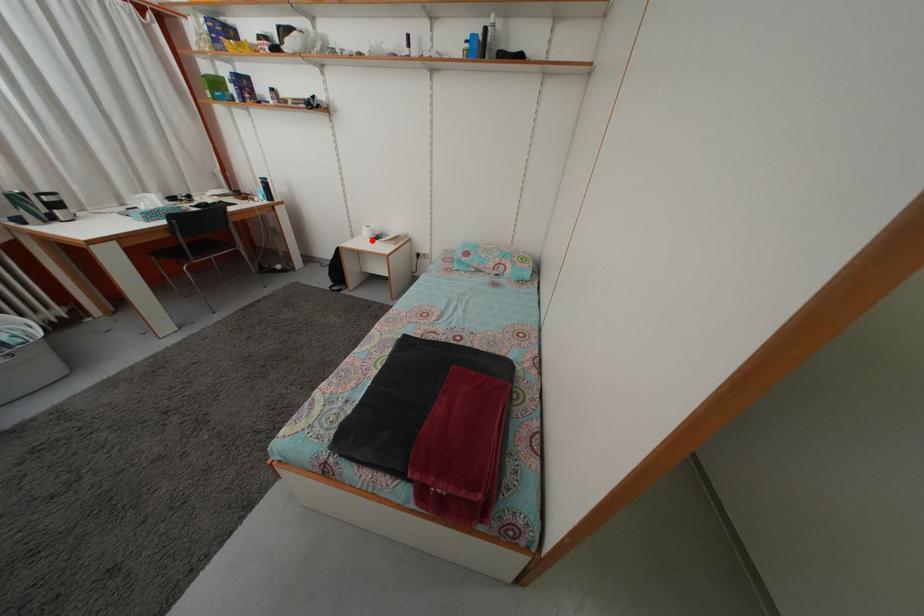
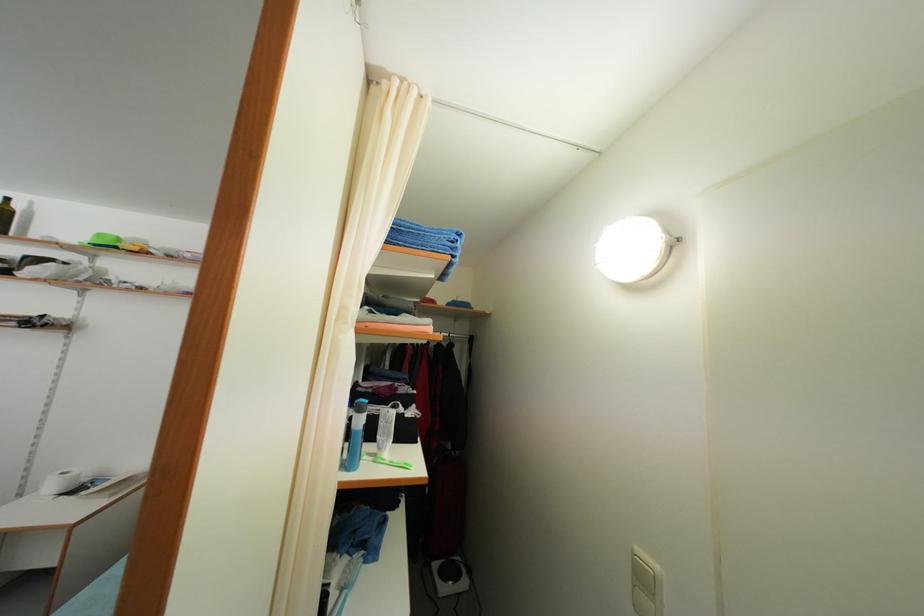
Locate, in the second image, the point that corresponds to the highlighted location in the first image.

(56, 493)